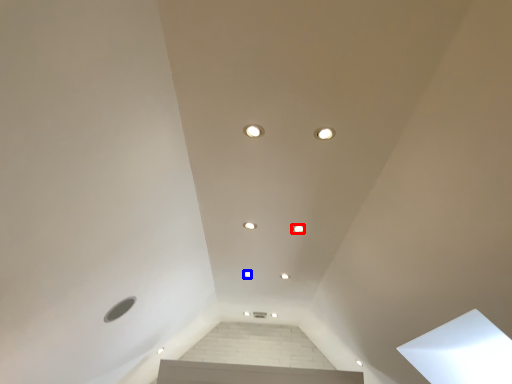
Question: Which of the following is the farthest to the observer, dot (highlighted by a red box) or dot (highlighted by a blue box)?

Choices:
 (A) dot
 (B) dot

Answer: (B)